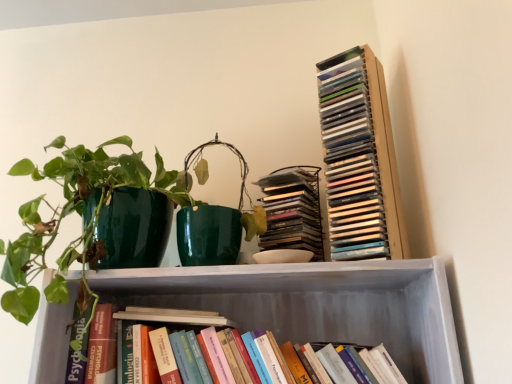
Question: Considering the positions of green glossy pot at left and hardcover books at lower center, the 3th book when ordered from top to bottom, in the image, is green glossy pot at left bigger or smaller than hardcover books at lower center, the 3th book when ordered from top to bottom,?

Choices:
 (A) big
 (B) small

Answer: (A)

Question: Is green glossy pot at left inside or outside of hardcover books at lower center, the 1th book positioned from the bottom?

Choices:
 (A) outside
 (B) inside

Answer: (A)

Question: Estimate the real-world distances between objects in this image. Which object is farther from the matte plastic stack of cds at upper right, marked as the 2th book in a bottom-to-top arrangement?

Choices:
 (A) green glossy pot at left
 (B) clear plastic stack of cds at upper right, acting as the first book starting from the top
 (C) hardcover books at lower center, the 3th book when ordered from top to bottom

Answer: (A)

Question: Estimate the real-world distances between objects in this image. Which object is farther from the green glossy pot at left?

Choices:
 (A) clear plastic stack of cds at upper right, positioned as the 3th book in bottom-to-top order
 (B) matte plastic stack of cds at upper right, the second book positioned from the top
 (C) hardcover books at lower center, the 3th book when ordered from top to bottom

Answer: (A)